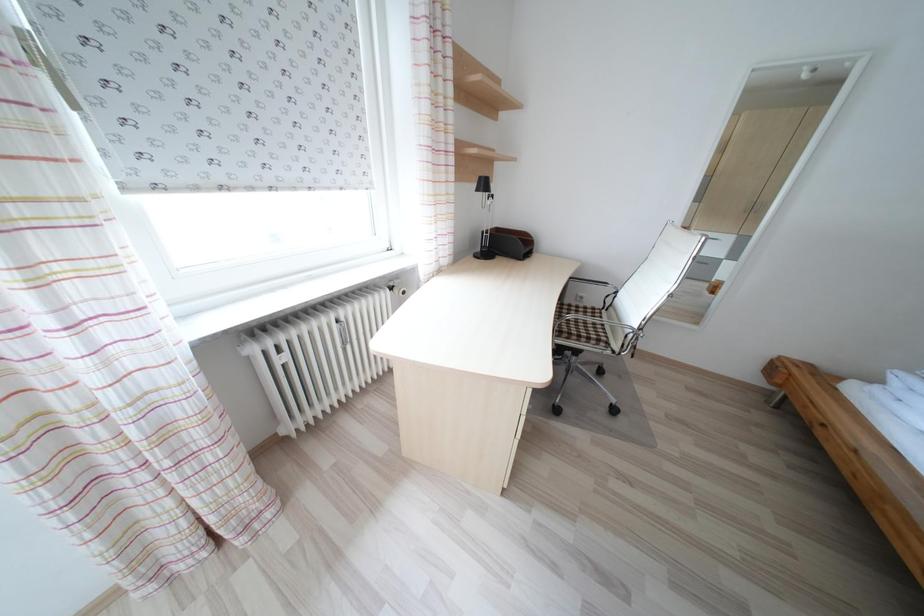
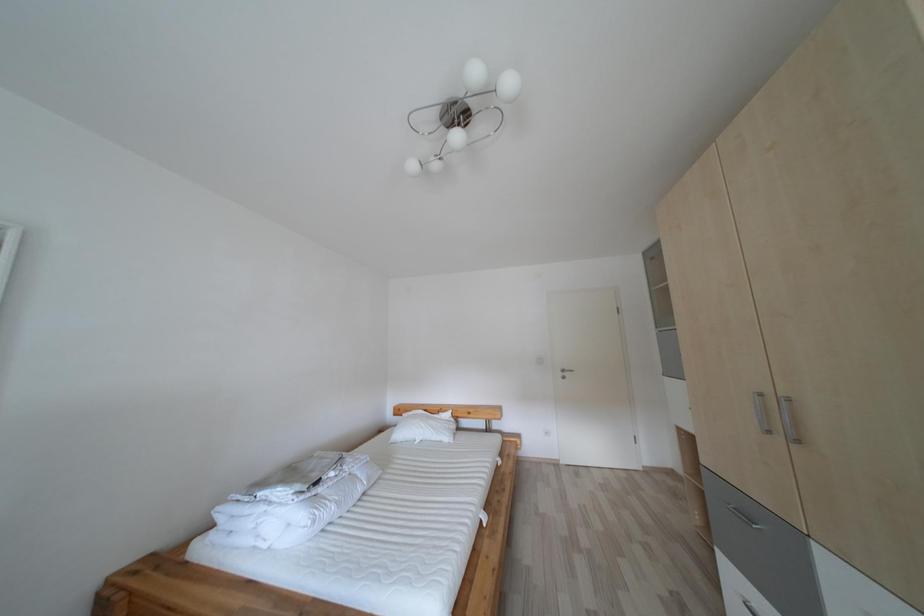
Question: The camera is either moving clockwise (left) or counter-clockwise (right) around the object. The first image is from the beginning of the video and the second image is from the end. Is the camera moving left or right when shooting the video?

Choices:
 (A) Left
 (B) Right

Answer: (A)